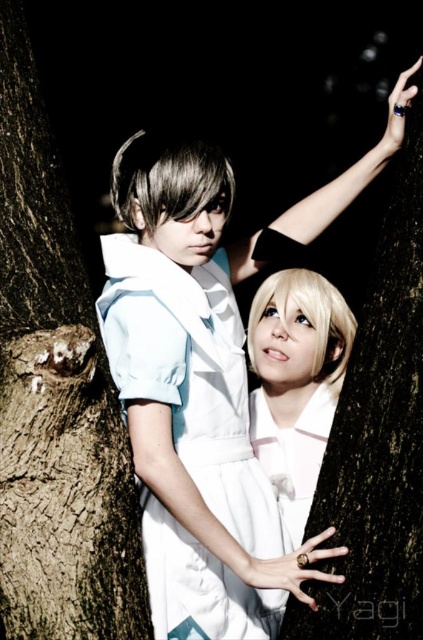
You are a photographer setting up a shoot in this nighttime scene. You need to position a small stool for the person in the white satin dress at center to sit on. The stool is 40 cm tall. Considering the height of the brown rough tree trunk at left, will the stool be visible above the dress when placed next to it?

The brown rough tree trunk at left is taller than the white satin dress at center. Since the stool is only 40 cm tall, it may not be visible above the dress if the dress is shorter than 40 cm. However, without knowing the exact height of the dress, we cannot definitively determine visibility.

You are a photographer setting up for a portrait shoot. You need to ensure that the brown rough tree trunk at left does not block the white satin dress at center in the final image. Based on their current positions, will the tree trunk block the dress?

The brown rough tree trunk at left is positioned over the white satin dress at center, so it will block the dress in the final image.